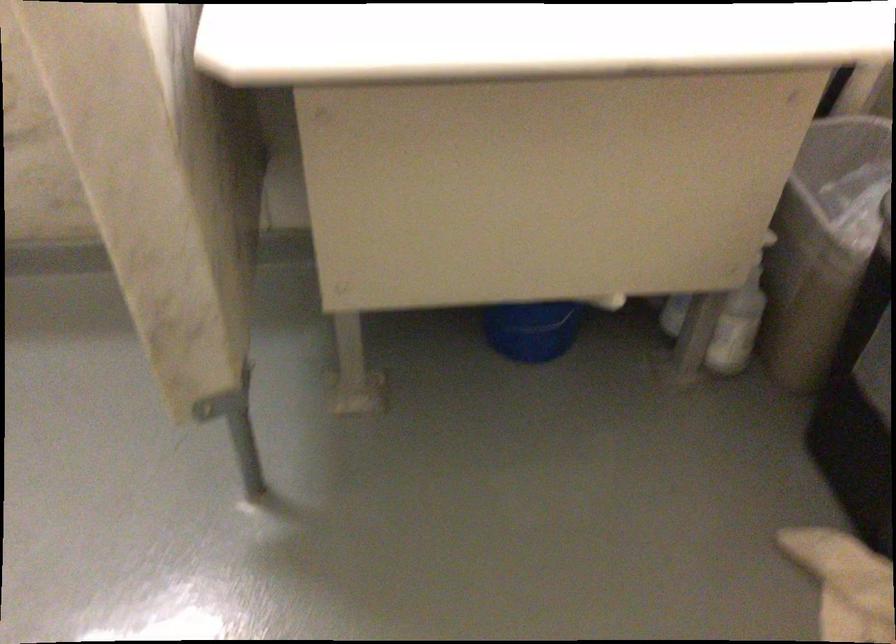
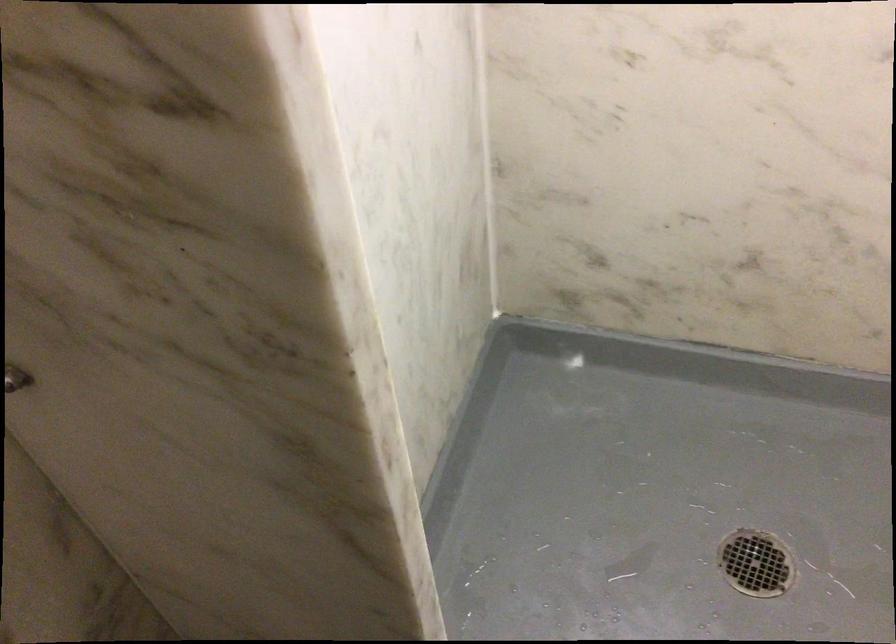
First-person continuous shooting, in which direction is the camera rotating?

The camera rotated toward left-down.